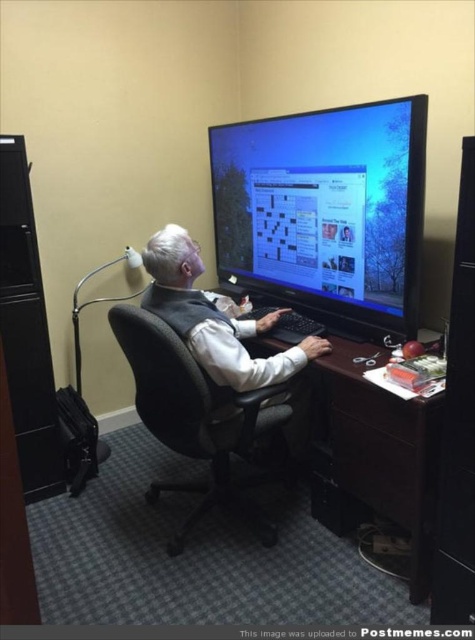
Question: Which point is farther to the camera?

Choices:
 (A) matte black monitor at upper center
 (B) black mesh office chair at center
 (C) white matte vest at center

Answer: (C)

Question: Does black mesh office chair at center appear on the left side of white matte vest at center?

Choices:
 (A) no
 (B) yes

Answer: (B)

Question: Can you confirm if brown wood computer desk at center is bigger than white matte vest at center?

Choices:
 (A) yes
 (B) no

Answer: (A)

Question: Which of the following is the farthest from the observer?

Choices:
 (A) (153, 252)
 (B) (247, 520)
 (C) (283, 172)
 (D) (388, 412)

Answer: (C)

Question: Does matte black monitor at upper center have a larger size compared to brown wood computer desk at center?

Choices:
 (A) no
 (B) yes

Answer: (B)

Question: Among these objects, which one is nearest to the camera?

Choices:
 (A) white matte vest at center
 (B) matte black monitor at upper center
 (C) brown wood computer desk at center
 (D) black mesh office chair at center

Answer: (C)